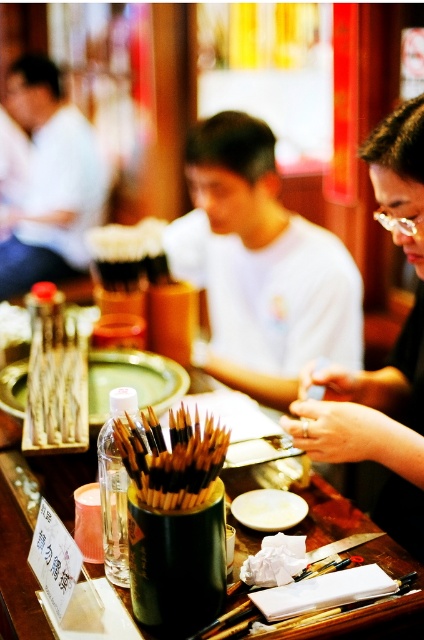
Which is more to the right, matte white shirt at upper left or wooden platter at center?

wooden platter at center

Can you confirm if matte white shirt at upper left is positioned below wooden platter at center?

No, matte white shirt at upper left is not below wooden platter at center.

At what (x,y) coordinates should I click in order to perform the action: click on matte white shirt at upper left. Please return your answer as a coordinate pair (x, y). Looking at the image, I should click on (50, 180).

The height and width of the screenshot is (640, 424). In order to click on matte white shirt at upper left in this screenshot , I will do `click(50, 180)`.

Is matte white shirt at upper left above white ceramic plate at center?

Yes, matte white shirt at upper left is above white ceramic plate at center.

Can you confirm if matte white shirt at upper left is positioned to the left of white ceramic plate at center?

Yes, matte white shirt at upper left is to the left of white ceramic plate at center.

Who is more distant from viewer, (61,132) or (276,515)?

Point (61,132)

Where is `matte white shirt at upper left`? This screenshot has height=640, width=424. matte white shirt at upper left is located at coordinates (50, 180).

Can you confirm if matte white shirt at center is wider than wooden platter at center?

Yes, matte white shirt at center is wider than wooden platter at center.

Can you confirm if matte white shirt at center is smaller than wooden platter at center?

Actually, matte white shirt at center might be larger than wooden platter at center.

Does point (206, 120) come farther from viewer compared to point (95, 408)?

Yes, it is behind point (95, 408).

The width and height of the screenshot is (424, 640). What are the coordinates of `matte white shirt at center` in the screenshot? It's located at (261, 266).